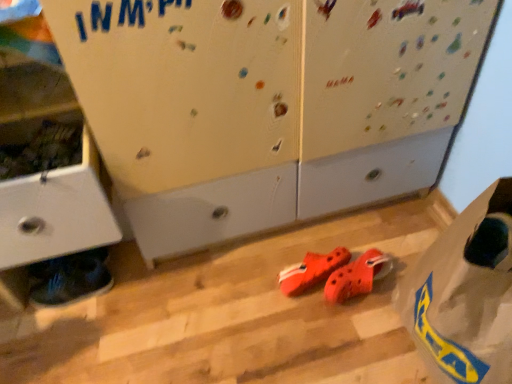
I want to click on empty space that is in between rubber/crocodile-patterned shoes at center, placed as the 2th footwear when sorted from right to left, and shiny blue sneakers at lower left, positioned as the 1th footwear in left-to-right order, so click(197, 284).